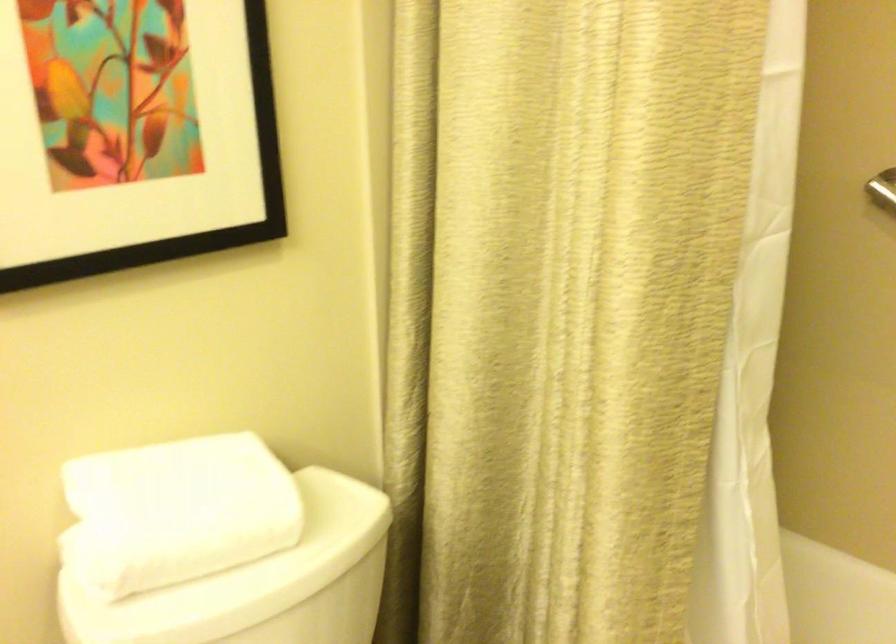
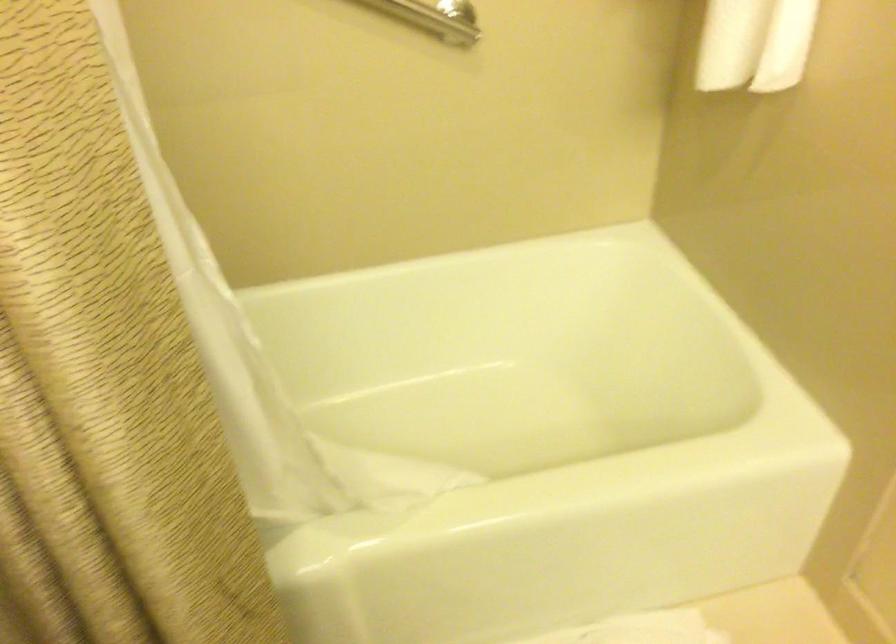
Based on the continuous images, in which direction is the camera rotating?

The camera's rotation is toward right-down.